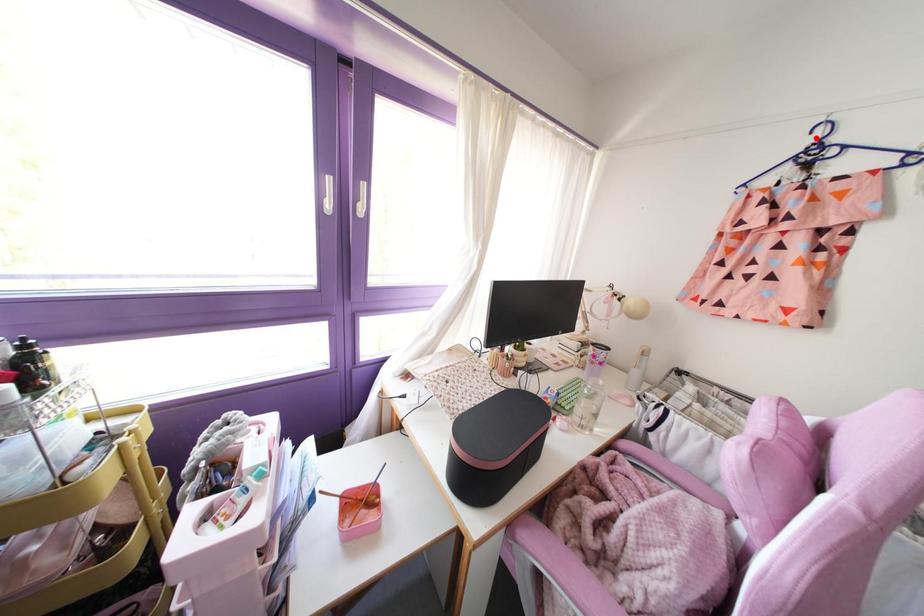
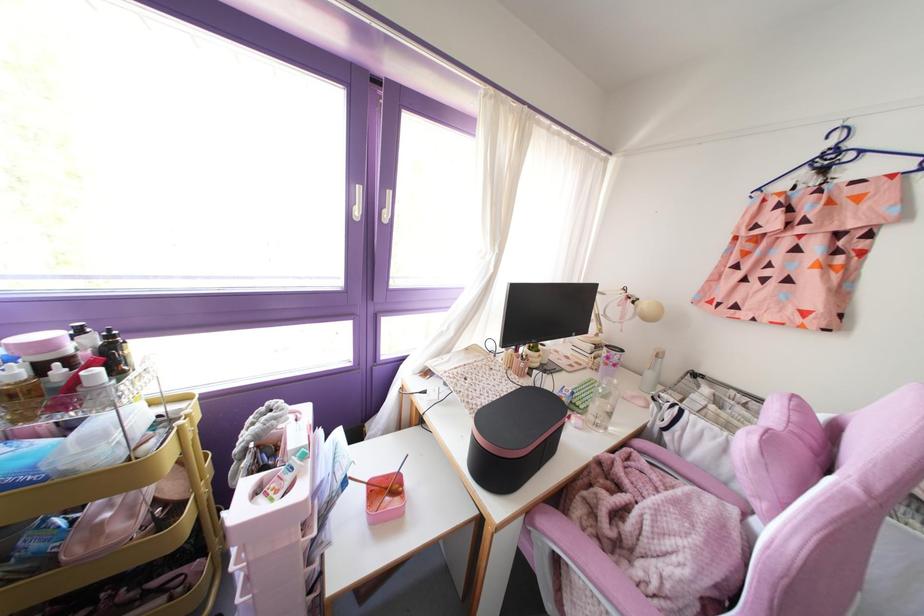
Question: A red point is marked in image1. In image2, is the corresponding 3D point closer to the camera or farther? Reply with the corresponding letter.

Choices:
 (A) The corresponding 3D point is closer.
 (B) The corresponding 3D point is farther.

Answer: (B)